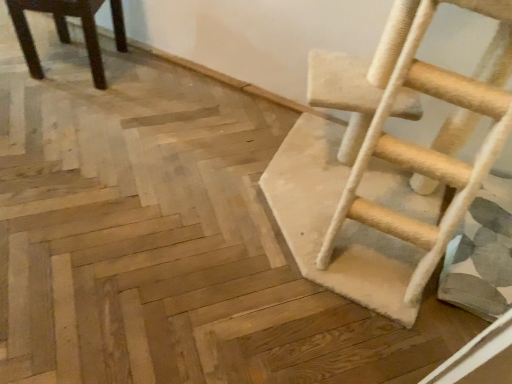
At what (x,y) coordinates should I click in order to perform the action: click on vacant space to the left of beige carpeted ladder at right. Please return your answer as a coordinate pair (x, y). The width and height of the screenshot is (512, 384). Looking at the image, I should click on (170, 177).